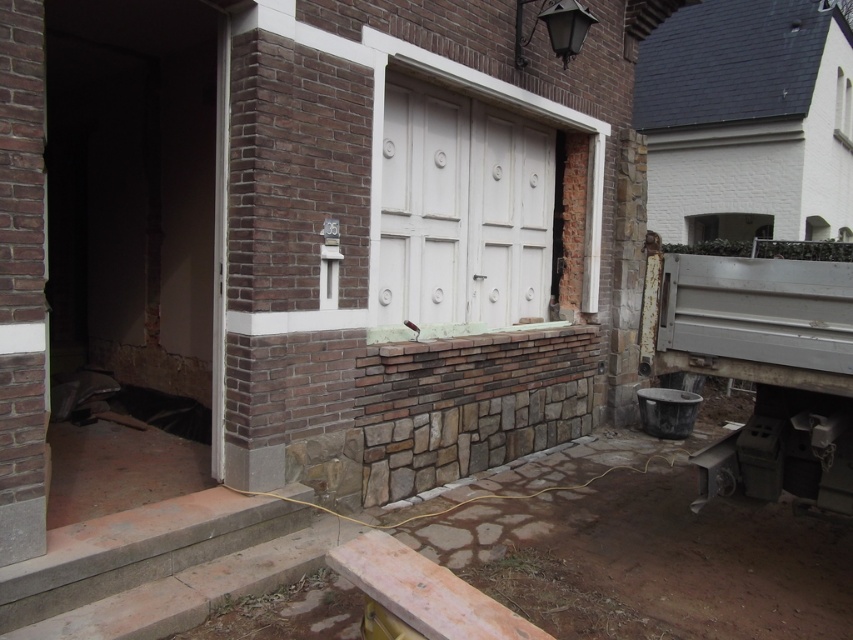
Looking at this image, you are a delivery person arriving at the building. You need to deliver a package to apartment 35. The entrance is through the white painted wood door at center. However, you notice the transparent glass window at upper right. Is the window above the door or to the side of the door?

The white painted wood door at center is positioned under the transparent glass window at upper right, so the window is above the door.

In the scene shown: You are standing at the entrance of the building and want to move towards the point marked as point (838,138). However, there is an obstacle at point (515,307). Can you safely navigate around the obstacle to reach your destination?

Point (515,307) is in front of point (838,138). Since the obstacle is located between you and your destination, you cannot safely navigate around it without moving the obstacle or choosing a different path.